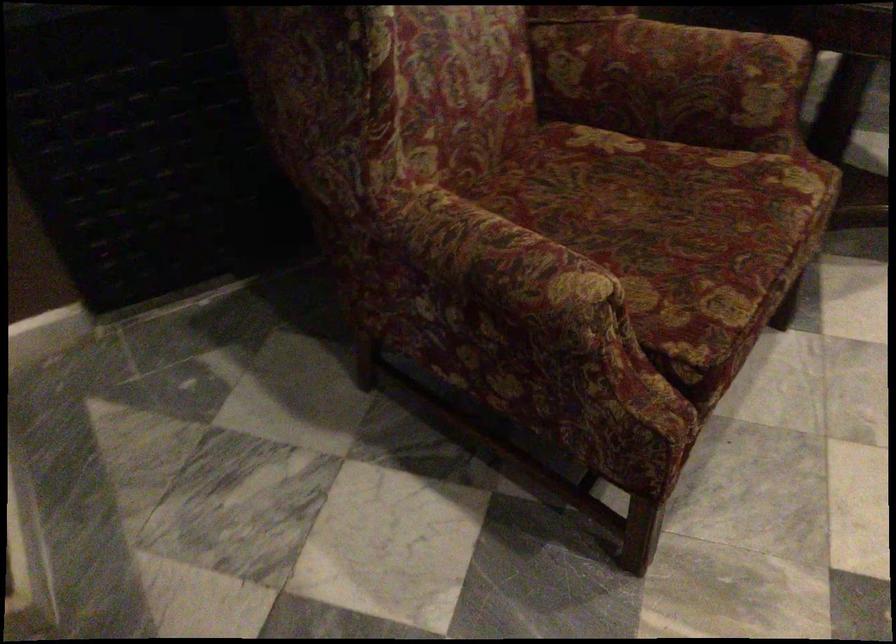
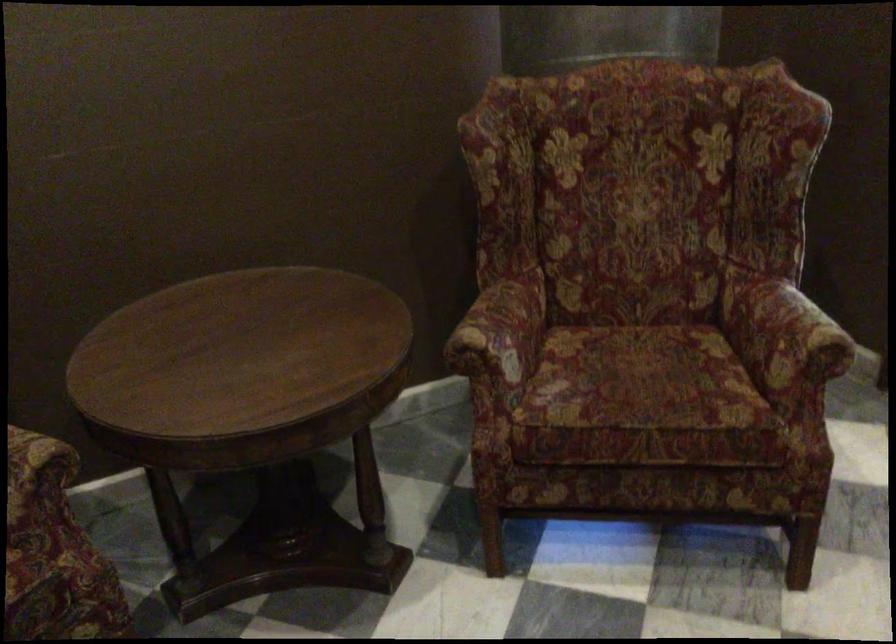
Question: Which direction would the cameraman need to move to produce the second image? Reply with the corresponding letter.

Choices:
 (A) Left
 (B) Right
 (C) Forward
 (D) Backward

Answer: (B)